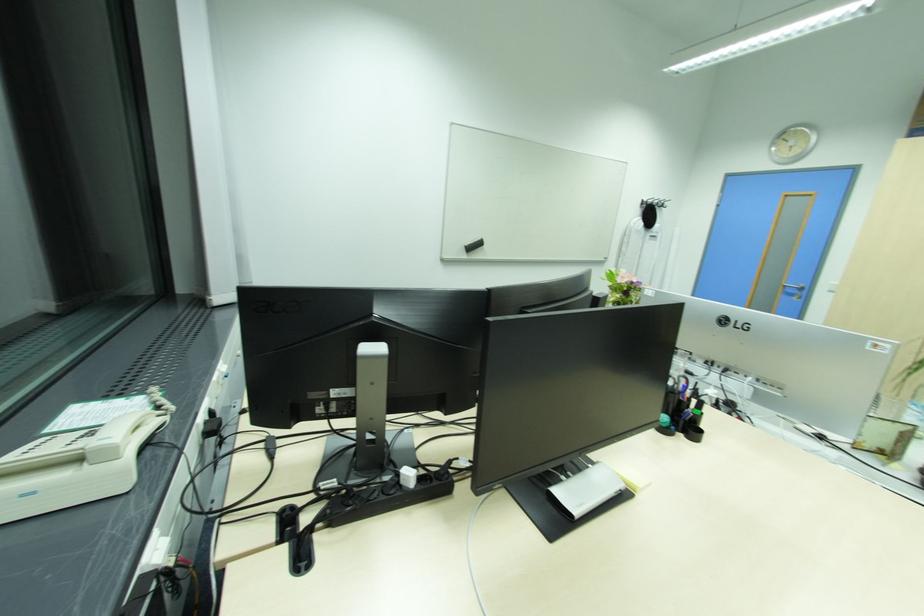
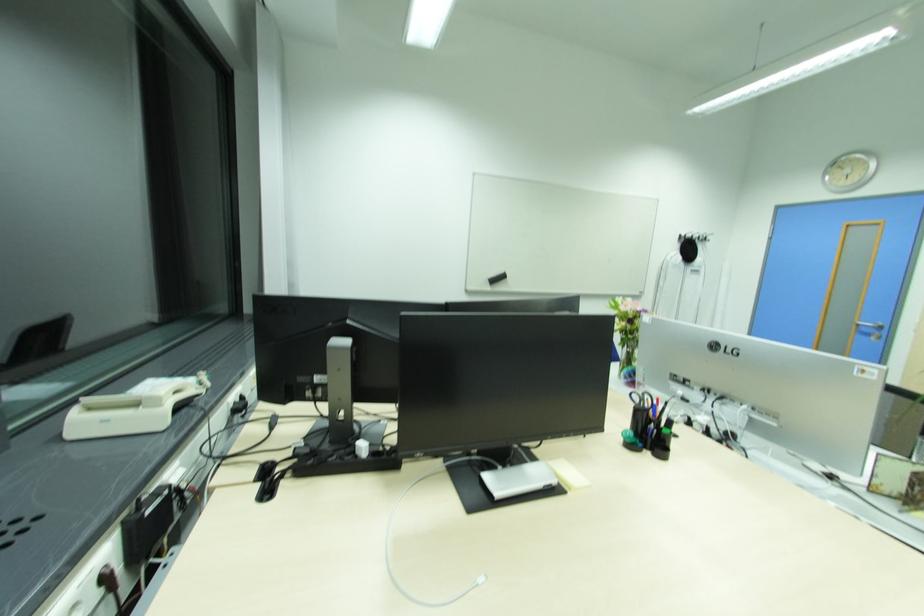
The point at (x=816, y=195) is marked in the first image. Where is the corresponding point in the second image?

(882, 224)